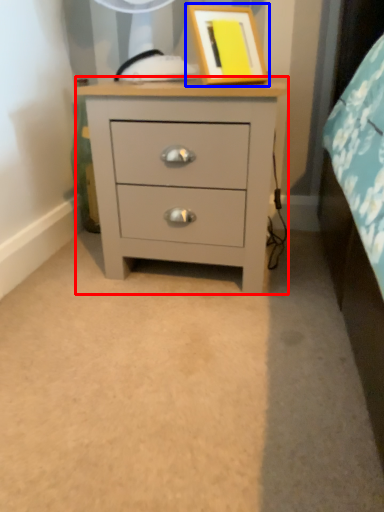
Question: Which object appears closest to the camera in this image, chest of drawers (highlighted by a red box) or picture frame (highlighted by a blue box)?

Choices:
 (A) chest of drawers
 (B) picture frame

Answer: (B)